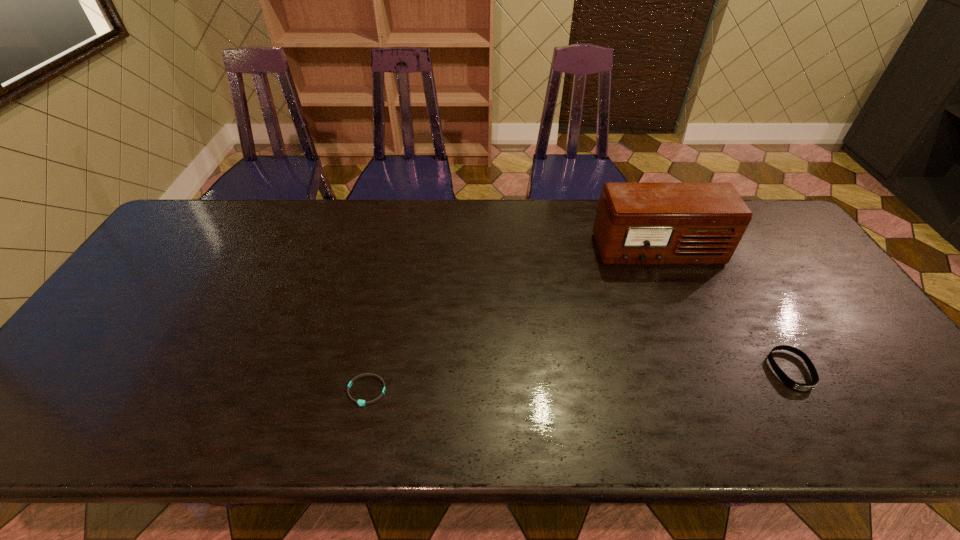
This screenshot has width=960, height=540. I want to click on the farthest object, so click(636, 223).

Where is `the tallest object`? This screenshot has height=540, width=960. the tallest object is located at coordinates (636, 223).

I want to click on the second shortest object, so coord(787,381).

Find the location of a particular element. The width and height of the screenshot is (960, 540). the taller wristband is located at coordinates (787, 381).

The width and height of the screenshot is (960, 540). I want to click on the shortest object, so click(360, 402).

The image size is (960, 540). I want to click on the left wristband, so click(360, 402).

Find the location of a particular element. The height and width of the screenshot is (540, 960). blank space located on the front-facing side of the radio receiver is located at coordinates (696, 339).

This screenshot has height=540, width=960. I want to click on vacant region located on the display of the second tallest object, so click(x=817, y=417).

Where is `free space located 0.080m on the buckle of the left wristband`? Image resolution: width=960 pixels, height=540 pixels. free space located 0.080m on the buckle of the left wristband is located at coordinates (356, 442).

Where is `object present at the far edge`? The image size is (960, 540). object present at the far edge is located at coordinates (636, 223).